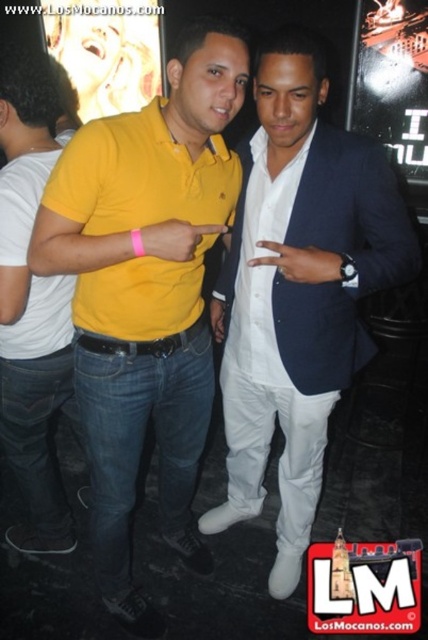
Question: Does matte yellow polo shirt at center have a greater width compared to matte yellow polo shirt at left?

Choices:
 (A) yes
 (B) no

Answer: (A)

Question: Among these points, which one is farthest from the camera?

Choices:
 (A) (115, 400)
 (B) (348, 308)
 (C) (56, 403)

Answer: (C)

Question: Which of the following is the farthest from the observer?

Choices:
 (A) white satin suit at center
 (B) white satin shirt at center

Answer: (B)

Question: Which point is farther from the camera taking this photo?

Choices:
 (A) (351, 138)
 (B) (284, 364)
 (C) (118, 339)
 (D) (45, 70)

Answer: (D)

Question: Does matte yellow polo shirt at left appear under white satin shirt at center?

Choices:
 (A) yes
 (B) no

Answer: (A)

Question: Does matte yellow polo shirt at center have a lesser width compared to white satin suit at center?

Choices:
 (A) yes
 (B) no

Answer: (A)